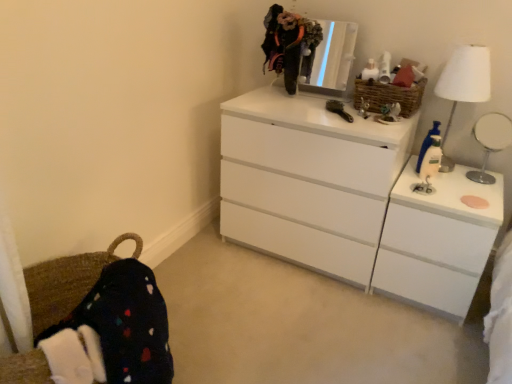
The image size is (512, 384). What do you see at coordinates (389, 96) in the screenshot?
I see `woven brown basket at upper right` at bounding box center [389, 96].

Measure the distance between point [488,49] and camera.

Point [488,49] and camera are 5.75 feet apart from each other.

Describe the element at coordinates (426, 143) in the screenshot. I see `blue plastic bottle at right` at that location.

Image resolution: width=512 pixels, height=384 pixels. Find the location of `blue plastic bottle at right`. blue plastic bottle at right is located at coordinates coord(426,143).

Measure the distance between point [269,252] and camera.

Point [269,252] is 6.98 feet from camera.

This screenshot has width=512, height=384. What do you see at coordinates (348, 201) in the screenshot?
I see `white glossy chest of drawers at upper right` at bounding box center [348, 201].

Image resolution: width=512 pixels, height=384 pixels. I want to click on white glossy file cabinet at right, so click(x=437, y=241).

From the image's perspective, would you say white fabric lampshade at right is shown under white glossy chest of drawers at upper right?

No.

This screenshot has width=512, height=384. Identify the location of table lamp above the white glossy chest of drawers at upper right (from a real-world perspective). (465, 79).

From a real-world perspective, which is physically below, white fabric lampshade at right or white glossy chest of drawers at upper right?

From a 3D spatial view, white glossy chest of drawers at upper right is below.

Can you confirm if white fabric lampshade at right is smaller than white glossy chest of drawers at upper right?

Yes.

Is blue plastic bottle at right in front of or behind white glossy file cabinet at right in the image?

Visually, blue plastic bottle at right is located behind white glossy file cabinet at right.

Locate an element on the screen. This screenshot has height=384, width=512. toy to the left of white glossy file cabinet at right is located at coordinates (426, 143).

From the image's perspective, would you say blue plastic bottle at right is positioned over white glossy file cabinet at right?

Indeed, from the image's perspective, blue plastic bottle at right is shown above white glossy file cabinet at right.

Consider the image. Which object is wider, blue plastic bottle at right or white glossy mirror at upper right?

Wider between the two is white glossy mirror at upper right.

From a real-world perspective, is blue plastic bottle at right under white glossy mirror at upper right?

Yes, from a real-world perspective, blue plastic bottle at right is under white glossy mirror at upper right.

Between point (419, 163) and point (499, 134), which one is positioned behind?

The point (499, 134) is more distant.

Between woven brown basket at upper right and fuzzy fabric at upper center, which one has larger size?

Bigger between the two is woven brown basket at upper right.

From the image's perspective, who appears lower, woven brown basket at upper right or fuzzy fabric at upper center?

woven brown basket at upper right.

Considering the positions of objects woven brown basket at upper right and fuzzy fabric at upper center in the image provided, who is more to the right, woven brown basket at upper right or fuzzy fabric at upper center?

Positioned to the right is woven brown basket at upper right.

Is woven brown basket at upper right located outside fuzzy fabric at upper center?

Absolutely, woven brown basket at upper right is external to fuzzy fabric at upper center.

This screenshot has height=384, width=512. Identify the location of file cabinet on the right of blue plastic bottle at right. (437, 241).

Looking at this image, is white glossy file cabinet at right turned away from blue plastic bottle at right?

white glossy file cabinet at right is not turned away from blue plastic bottle at right.

Is white glossy file cabinet at right not within blue plastic bottle at right?

Yes.

Which point is more distant from viewer, (440, 251) or (430, 134)?

The point (430, 134) is more distant.

Relative to white glossy file cabinet at right, is white glossy chest of drawers at upper right in front or behind?

Visually, white glossy chest of drawers at upper right is located behind white glossy file cabinet at right.

From a real-world perspective, which object rests below the other?

white glossy file cabinet at right, from a real-world perspective.

Which object is wider, white glossy chest of drawers at upper right or white glossy file cabinet at right?

white glossy chest of drawers at upper right is wider.

Considering the positions of objects white fabric lampshade at right and blue plastic bottle at right in the image provided, who is in front, white fabric lampshade at right or blue plastic bottle at right?

Positioned in front is white fabric lampshade at right.

At what (x,y) coordinates should I click in order to perform the action: click on toy lying below the white fabric lampshade at right (from the image's perspective). Please return your answer as a coordinate pair (x, y). The width and height of the screenshot is (512, 384). Looking at the image, I should click on (426, 143).

Which is correct: white fabric lampshade at right is inside blue plastic bottle at right, or outside of it?

white fabric lampshade at right is spatially situated outside blue plastic bottle at right.

Is point (454, 110) farther from viewer compared to point (438, 128)?

Yes, point (454, 110) is behind point (438, 128).

Where is `table lamp above the white glossy chest of drawers at upper right (from a real-world perspective)`? This screenshot has height=384, width=512. table lamp above the white glossy chest of drawers at upper right (from a real-world perspective) is located at coordinates (465, 79).

Locate an element on the screen. Image resolution: width=512 pixels, height=384 pixels. file cabinet below the blue plastic bottle at right (from the image's perspective) is located at coordinates click(437, 241).

Looking at the image, which one is located further to blue plastic bottle at right, white glossy chest of drawers at upper right or white glossy file cabinet at right?

white glossy chest of drawers at upper right is positioned further to the anchor blue plastic bottle at right.

When comparing their distances from blue plastic bottle at right, does white glossy chest of drawers at upper right or woven brown basket at upper right seem further?

white glossy chest of drawers at upper right is positioned further to the anchor blue plastic bottle at right.

From the image, which object appears to be nearer to blue plastic bottle at right, white fabric lampshade at right or white glossy chest of drawers at upper right?

white fabric lampshade at right lies closer to blue plastic bottle at right than the other object.

Which object lies further to the anchor point white glossy mirror at upper right, woven brown basket at upper right or white glossy file cabinet at right?

Among the two, white glossy file cabinet at right is located further to white glossy mirror at upper right.

Looking at the image, which one is located closer to white glossy mirror at upper right, white glossy chest of drawers at upper right or blue plastic bottle at right?

blue plastic bottle at right is closer to white glossy mirror at upper right.

From the image, which object appears to be farther from metallic reflective mirror at upper center, white glossy mirror at upper right or woven brown basket at upper right?

white glossy mirror at upper right is positioned further to the anchor metallic reflective mirror at upper center.

Considering their positions, is metallic reflective mirror at upper center positioned further to fuzzy fabric at upper center than white fabric lampshade at right?

white fabric lampshade at right lies further to fuzzy fabric at upper center than the other object.

Considering their positions, is white glossy file cabinet at right positioned closer to fuzzy fabric at upper center than white fabric lampshade at right?

Based on the image, white fabric lampshade at right appears to be nearer to fuzzy fabric at upper center.

You are a GUI agent. You are given a task and a screenshot of the screen. Output one action in this format:
    pyautogui.click(x=<x>, y=<y>)
    Task: Click on the toy between fuzzy fabric at upper center and white glossy chest of drawers at upper right in the vertical direction
    This screenshot has height=384, width=512.
    Given the screenshot: What is the action you would take?
    pyautogui.click(x=426, y=143)

Find the location of a particular element. The image size is (512, 384). toy between white fabric lampshade at right and white glossy file cabinet at right in the up-down direction is located at coordinates (426, 143).

The image size is (512, 384). Find the location of `toy situated between metallic reflective mirror at upper center and white fabric lampshade at right from left to right`. toy situated between metallic reflective mirror at upper center and white fabric lampshade at right from left to right is located at coordinates (426, 143).

Locate an element on the screen. This screenshot has width=512, height=384. chest of drawers between fuzzy fabric at upper center and white fabric lampshade at right in the horizontal direction is located at coordinates click(x=348, y=201).